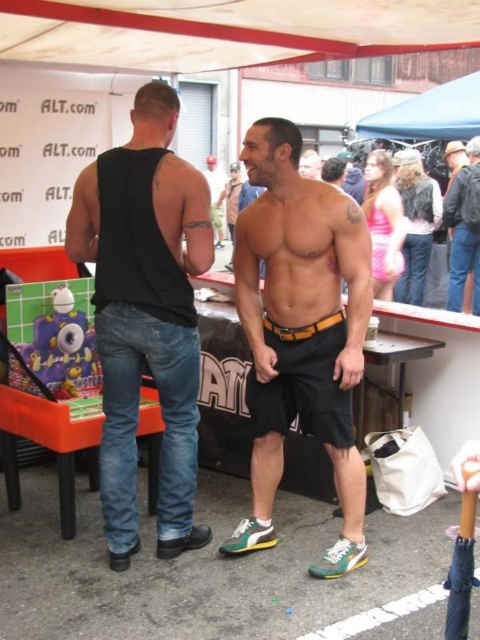
Question: Does shiny metallic belt at center have a larger size compared to smooth skin torso at center?

Choices:
 (A) no
 (B) yes

Answer: (B)

Question: Which object is farther from the camera taking this photo?

Choices:
 (A) dark gray jacket at upper right
 (B) orange leather belt at center
 (C) blue fabric canopy at upper center

Answer: (C)

Question: Which of these objects is positioned closest to the dark gray jacket at upper right?

Choices:
 (A) orange leather belt at center
 (B) black matte shorts at center
 (C) shiny metallic belt at center

Answer: (B)

Question: Can you confirm if black denim jeans at left is smaller than shiny metallic belt at center?

Choices:
 (A) yes
 (B) no

Answer: (B)

Question: Is black matte shorts at center below blue fabric canopy at upper center?

Choices:
 (A) yes
 (B) no

Answer: (A)

Question: Based on their relative distances, which object is farther from the black matte shorts at center?

Choices:
 (A) dark gray jacket at upper right
 (B) smooth skin torso at center
 (C) black denim jeans at left

Answer: (B)